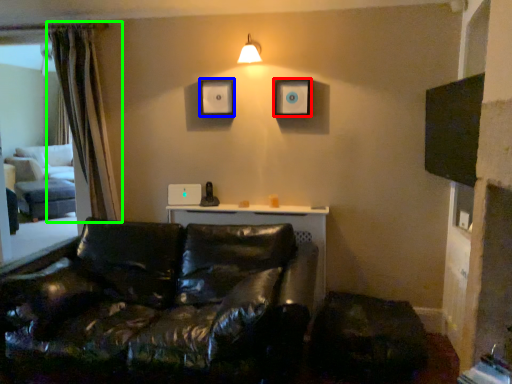
Question: Which object is positioned farthest from picture frame (highlighted by a red box)? Select from picture frame (highlighted by a blue box) and curtain (highlighted by a green box).

Choices:
 (A) picture frame
 (B) curtain

Answer: (B)